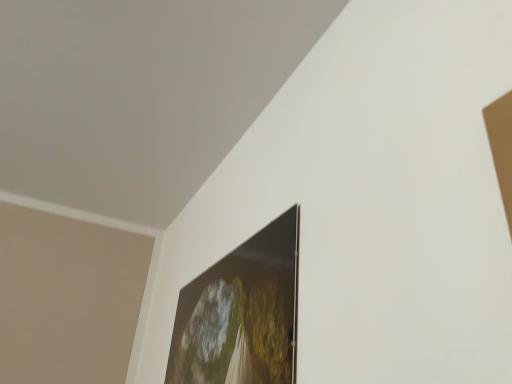
The width and height of the screenshot is (512, 384). Describe the element at coordinates (242, 314) in the screenshot. I see `metallic glossy picture frame at upper right` at that location.

This screenshot has height=384, width=512. Find the location of `metallic glossy picture frame at upper right`. metallic glossy picture frame at upper right is located at coordinates (242, 314).

What are the coordinates of `metallic glossy picture frame at upper right` in the screenshot? It's located at (242, 314).